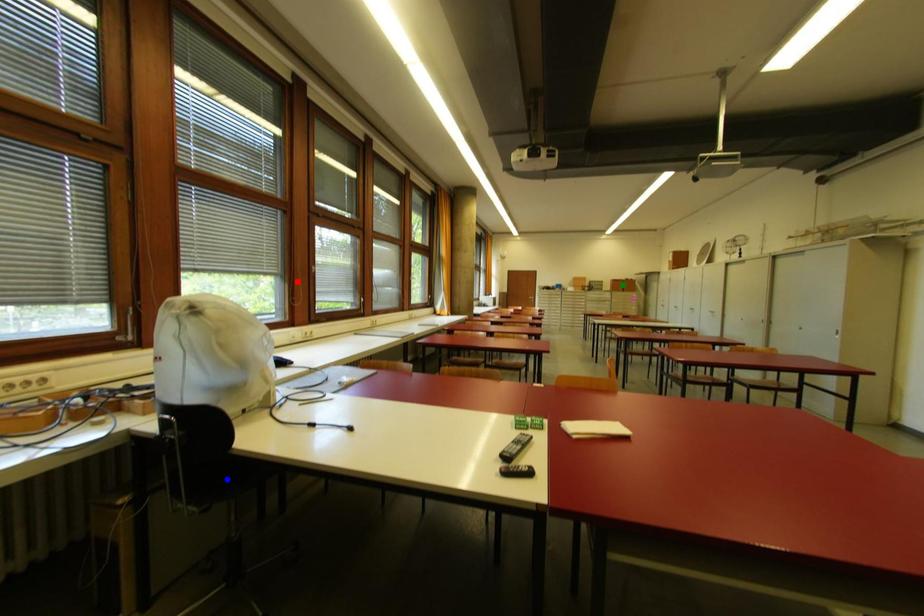
Order these from nearest to farthest:
green point | blue point | red point

blue point → red point → green point